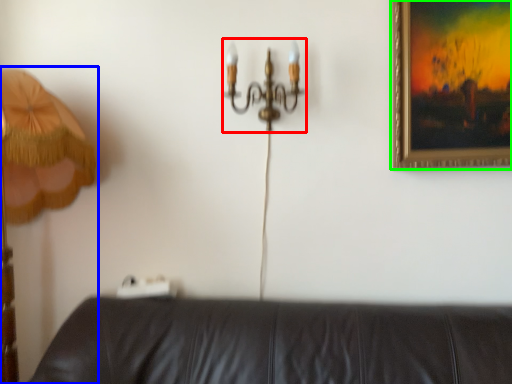
Question: Estimate the real-world distances between objects in this image. Which object is closer to chandelier (highlighted by a red box), lamp (highlighted by a blue box) or picture frame (highlighted by a green box)?

Choices:
 (A) lamp
 (B) picture frame

Answer: (B)